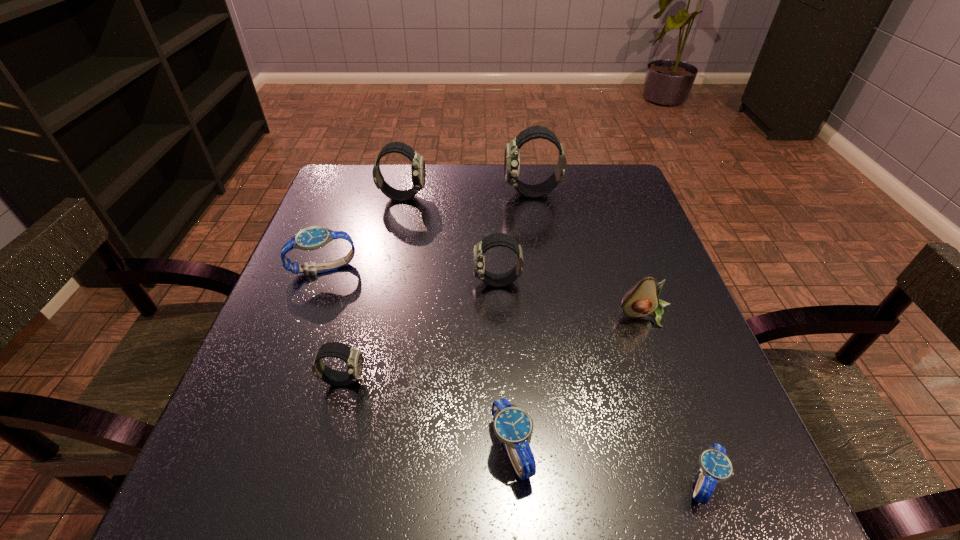
What are the coordinates of `the fifth farthest watch` in the screenshot? It's located at (353, 357).

Image resolution: width=960 pixels, height=540 pixels. Identify the location of the second smallest blue watch. coord(513,426).

Identify the location of the second shortest watch. (513, 426).

The width and height of the screenshot is (960, 540). In order to click on the rightmost blue watch in this screenshot , I will do `click(715, 466)`.

Find the location of a particular element. This screenshot has height=540, width=960. the shortest object is located at coordinates (715, 466).

I want to click on vacant space situated 0.260m on the face of the biggest dark watch, so click(x=407, y=194).

I want to click on free region located 0.050m on the face of the biggest dark watch, so click(485, 194).

You are a GUI agent. You are given a task and a screenshot of the screen. Output one action in this format:
    pyautogui.click(x=<x>, y=<y>)
    Task: Click on the vacant space located 0.210m on the face of the biggest dark watch
    The height and width of the screenshot is (540, 960).
    Given the screenshot: What is the action you would take?
    pyautogui.click(x=425, y=194)

Where is `vacant space located on the face of the sixth shortest watch`? vacant space located on the face of the sixth shortest watch is located at coordinates (563, 197).

Identify the location of blank space located on the face of the second nearest dark watch. (408, 282).